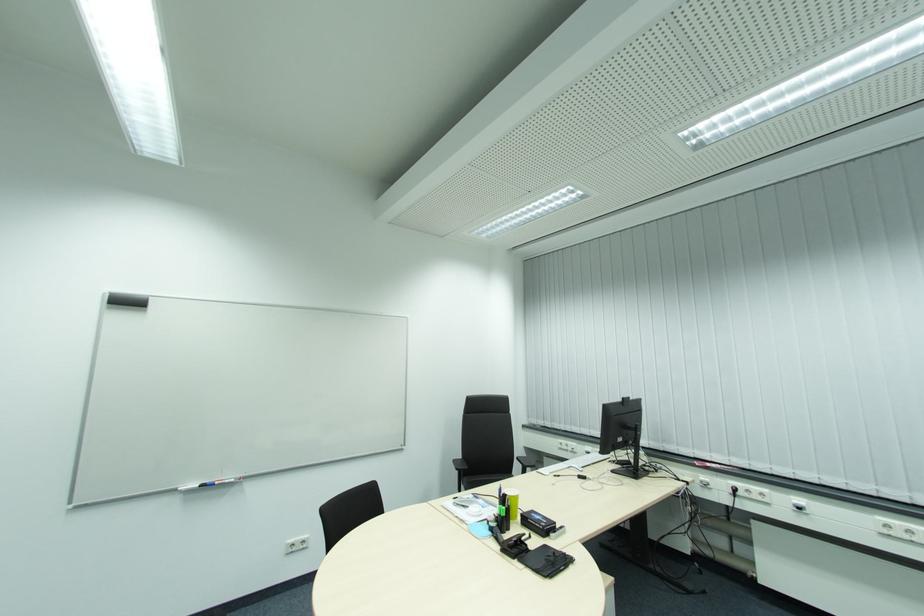
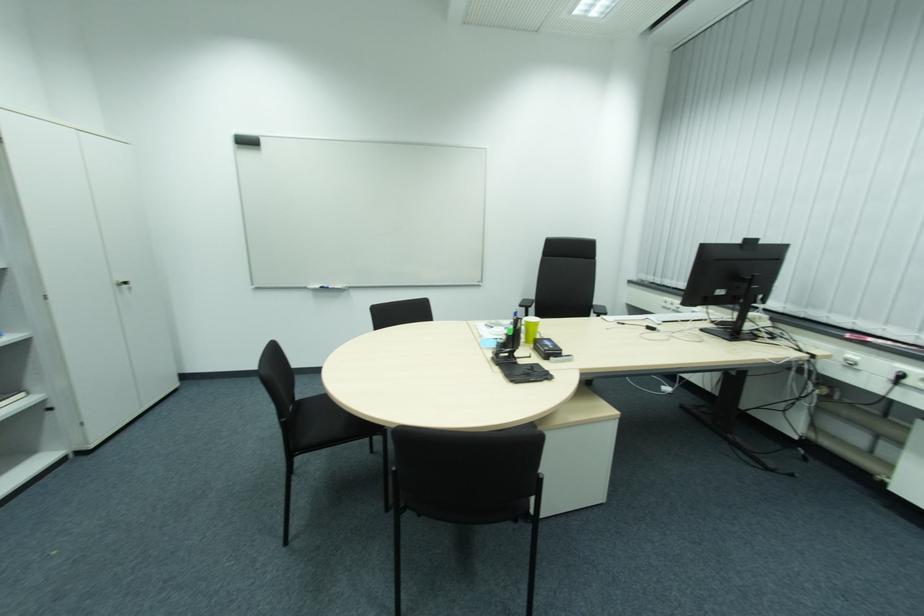
Locate, in the second image, the point that corresponds to pixel 136 302 in the first image.

(252, 144)